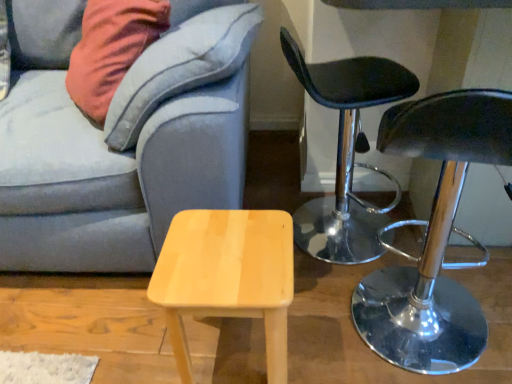
Locate an element on the screen. blank area beneath light wood stool at center (from a real-world perspective) is located at coordinates (226, 349).